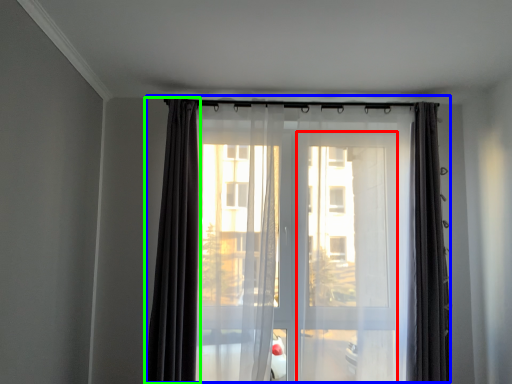
Question: Which object is the farthest from screen door (highlighted by a red box)? Choose among these: curtain (highlighted by a blue box) or curtain (highlighted by a green box).

Choices:
 (A) curtain
 (B) curtain

Answer: (A)